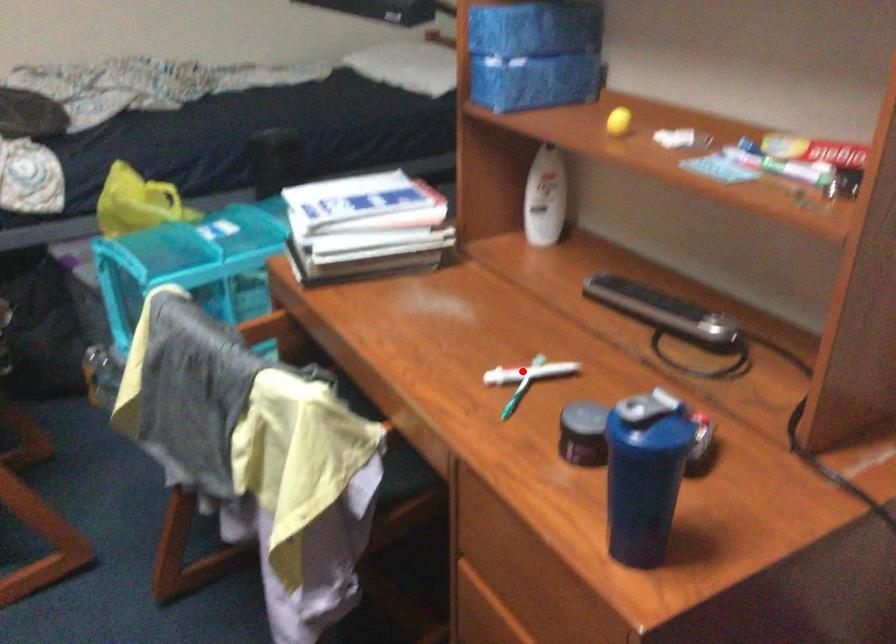
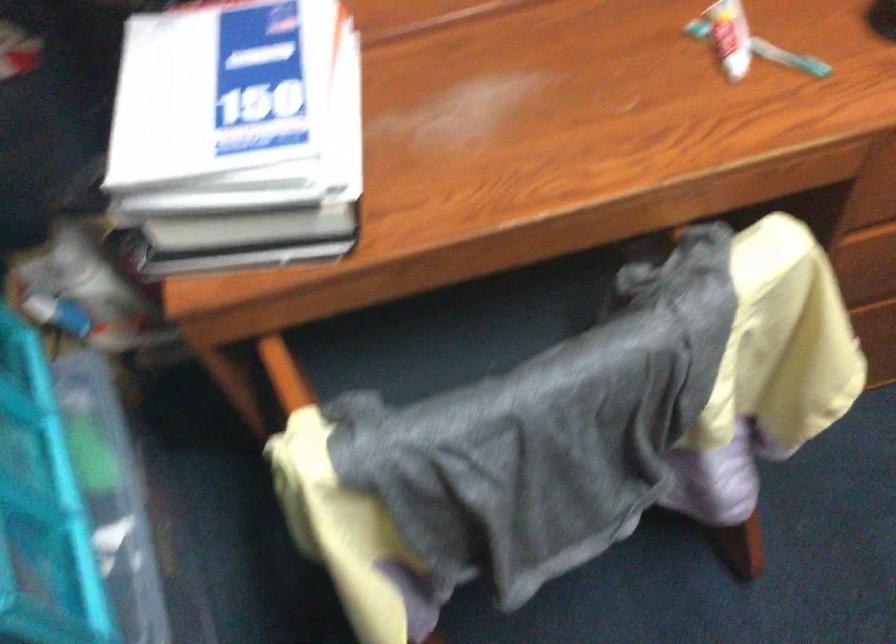
Question: A red point is marked in image1. In image2, is the corresponding 3D point closer to the camera or farther? Reply with the corresponding letter.

Choices:
 (A) The corresponding 3D point is closer.
 (B) The corresponding 3D point is farther.

Answer: (A)